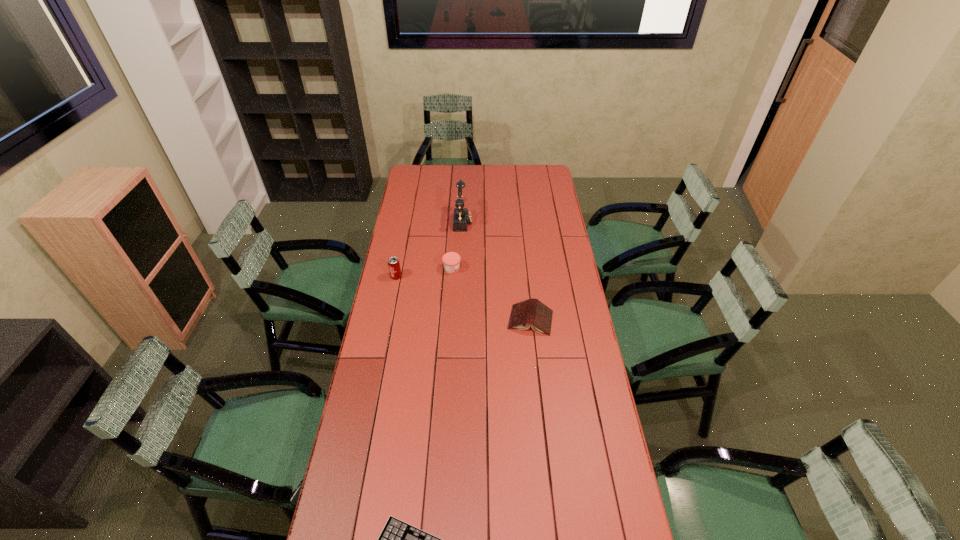
What are the coordinates of `the farthest object` in the screenshot? It's located at (462, 216).

Find the location of a particular element. This screenshot has width=960, height=540. telephone is located at coordinates (462, 216).

This screenshot has height=540, width=960. Identify the location of beer can. (393, 262).

Locate an element on the screen. the second tallest object is located at coordinates (393, 262).

Find the location of a particular element. This screenshot has height=540, width=960. jam is located at coordinates (451, 260).

Image resolution: width=960 pixels, height=540 pixels. I want to click on the rightmost object, so click(533, 312).

Where is `the fourth farthest object`? Image resolution: width=960 pixels, height=540 pixels. the fourth farthest object is located at coordinates (533, 312).

Image resolution: width=960 pixels, height=540 pixels. I want to click on free space located on the dial of the farthest object, so click(x=506, y=221).

This screenshot has width=960, height=540. Find the location of `vacant space located on the back of the fourth shortest object`. vacant space located on the back of the fourth shortest object is located at coordinates (405, 230).

Where is `free space located on the front label of the jam`? This screenshot has height=540, width=960. free space located on the front label of the jam is located at coordinates (538, 269).